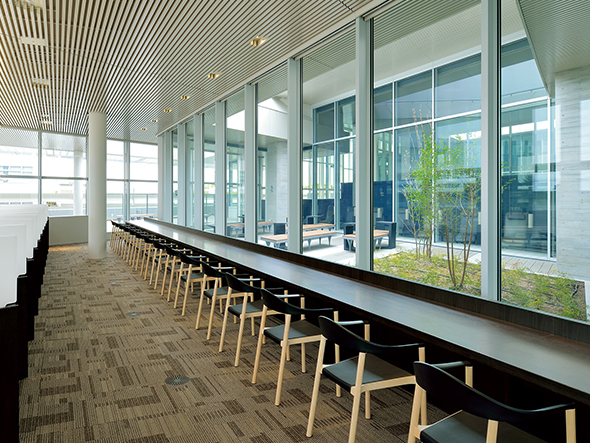
You are a GUI agent. You are given a task and a screenshot of the screen. Output one action in this format:
    pyautogui.click(x=<x>, y=<y>)
    Task: Click on the silver bars between windows
    
    Given the screenshot: What is the action you would take?
    pos(488,240), pos(363,164), pos(295,152), pos(252,164), pos(222,176), pos(194,192), pos(183,202), pos(167,206)